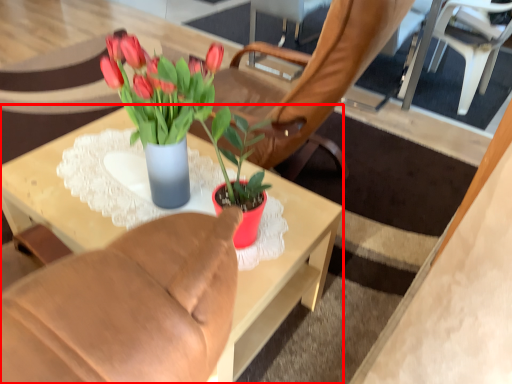
Question: From the image's perspective, what is the correct spatial relationship of desk (annotated by the red box) in relation to chair?

Choices:
 (A) above
 (B) below

Answer: (B)